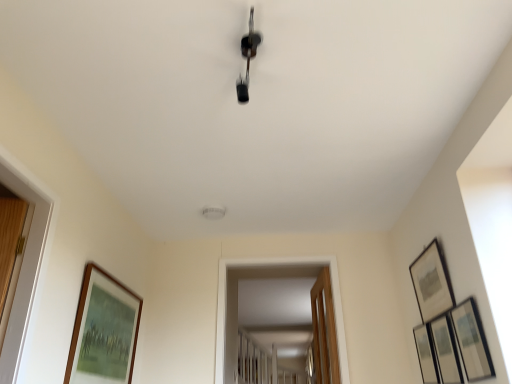
Question: From the image's perspective, is matte black picture frame at upper right, which appears as the third picture frame when viewed from the left, located above or below wooden-framed painting at lower left, the 5th picture frame in the right-to-left sequence?

Choices:
 (A) below
 (B) above

Answer: (B)

Question: Is point (432, 254) closer or farther from the camera than point (74, 326)?

Choices:
 (A) closer
 (B) farther

Answer: (B)

Question: Which of these objects is positioned farthest from the wooden door at center?

Choices:
 (A) wooden-framed painting at lower left, acting as the 1th picture frame starting from the left
 (B) matte black picture frame at right, marked as the 2th picture frame in a left-to-right arrangement
 (C) matte black picture frame at upper right, which appears as the third picture frame when viewed from the left
 (D) wooden framed picture at right, acting as the second picture frame starting from the right
 (E) metallic silver picture frame at right, the first picture frame from the right

Answer: (A)

Question: Which is nearer to the wooden-framed painting at lower left, acting as the 1th picture frame starting from the left?

Choices:
 (A) metallic silver picture frame at right, the first picture frame from the right
 (B) matte black picture frame at right, arranged as the 4th picture frame when viewed from the right
 (C) wooden framed picture at right, which is the fourth picture frame from left to right
 (D) matte black picture frame at upper right, which appears as the third picture frame when viewed from the left
 (E) wooden door at center

Answer: (E)